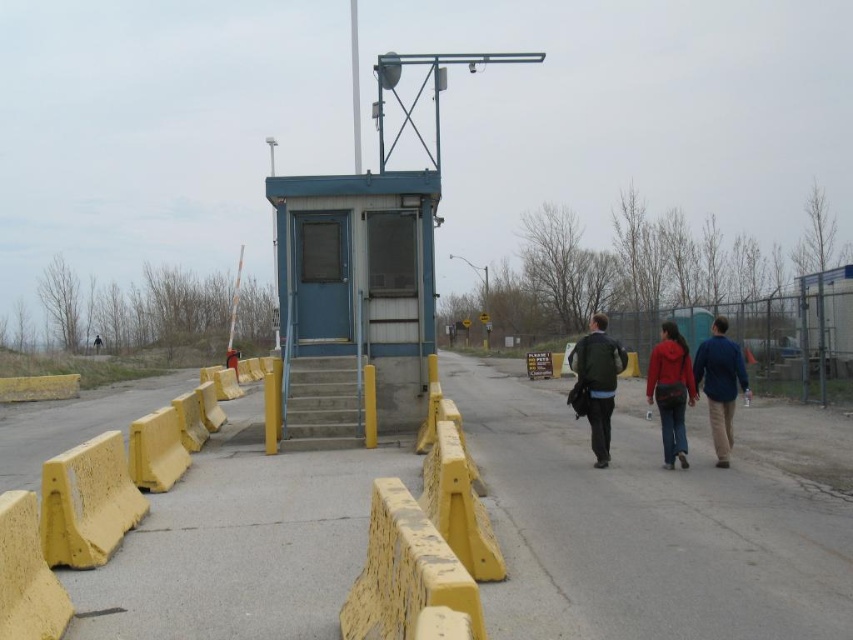
Between blue painted metal booth at center and dark green jacket at center, which one has less height?

blue painted metal booth at center

Describe the element at coordinates (352, 298) in the screenshot. I see `blue painted metal booth at center` at that location.

The height and width of the screenshot is (640, 853). I want to click on blue painted metal booth at center, so click(x=352, y=298).

Is point (331, 442) closer to camera compared to point (602, 330)?

That is False.

Is yellow concrete stairs at center closer to the viewer compared to dark green jacket at center?

No, yellow concrete stairs at center is behind dark green jacket at center.

The height and width of the screenshot is (640, 853). I want to click on yellow concrete stairs at center, so click(328, 403).

Is blue painted metal booth at center behind matte red hoodie at center?

Yes, it is.

Which is more to the left, blue painted metal booth at center or matte red hoodie at center?

From the viewer's perspective, blue painted metal booth at center appears more on the left side.

Where is `blue painted metal booth at center`? This screenshot has height=640, width=853. blue painted metal booth at center is located at coordinates click(x=352, y=298).

At what (x,y) coordinates should I click in order to perform the action: click on blue painted metal booth at center. Please return your answer as a coordinate pair (x, y). Looking at the image, I should click on (352, 298).